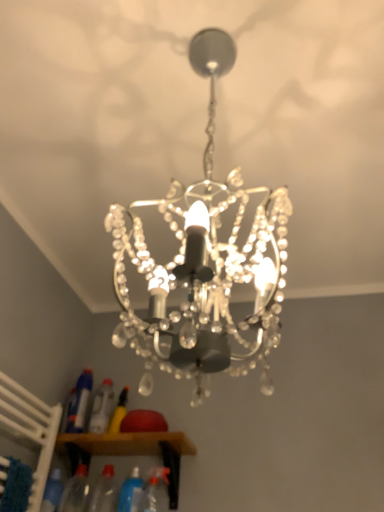
Question: Does clear plastic bottle at lower left, which is the 4th bottle from right to left, have a lesser width compared to wooden cabinet at lower center?

Choices:
 (A) yes
 (B) no

Answer: (A)

Question: Is clear plastic bottle at lower left, which is the 3th bottle in left-to-right order, closer to the viewer compared to wooden cabinet at lower center?

Choices:
 (A) yes
 (B) no

Answer: (B)

Question: Can you confirm if clear plastic bottle at lower left, which is the 4th bottle from right to left, is taller than wooden cabinet at lower center?

Choices:
 (A) yes
 (B) no

Answer: (A)

Question: Is clear plastic bottle at lower left, which is the 3th bottle in left-to-right order, positioned with its back to wooden cabinet at lower center?

Choices:
 (A) yes
 (B) no

Answer: (B)

Question: Is clear plastic bottle at lower left, which is the 4th bottle from right to left, located outside wooden cabinet at lower center?

Choices:
 (A) yes
 (B) no

Answer: (A)

Question: From a real-world perspective, is clear plastic bottle at lower left, which is the 3th bottle in left-to-right order, on wooden cabinet at lower center?

Choices:
 (A) no
 (B) yes

Answer: (B)

Question: Considering the relative positions of wooden cabinet at lower center and clear crystal chandelier at center in the image provided, is wooden cabinet at lower center to the left of clear crystal chandelier at center from the viewer's perspective?

Choices:
 (A) yes
 (B) no

Answer: (A)

Question: Considering the relative positions of wooden cabinet at lower center and clear crystal chandelier at center in the image provided, is wooden cabinet at lower center to the right of clear crystal chandelier at center from the viewer's perspective?

Choices:
 (A) yes
 (B) no

Answer: (B)

Question: From the image's perspective, does wooden cabinet at lower center appear lower than clear crystal chandelier at center?

Choices:
 (A) no
 (B) yes

Answer: (B)

Question: Does wooden cabinet at lower center have a greater width compared to clear crystal chandelier at center?

Choices:
 (A) yes
 (B) no

Answer: (B)

Question: Can you confirm if wooden cabinet at lower center is bigger than clear crystal chandelier at center?

Choices:
 (A) no
 (B) yes

Answer: (A)

Question: Is wooden cabinet at lower center completely or partially outside of clear crystal chandelier at center?

Choices:
 (A) no
 (B) yes

Answer: (B)

Question: Considering the relative sizes of transparent plastic bottle at lower center, the 3th bottle positioned from the right, and translucent plastic spray bottle at lower left, positioned as the first bottle in left-to-right order, in the image provided, is transparent plastic bottle at lower center, the 3th bottle positioned from the right, thinner than translucent plastic spray bottle at lower left, positioned as the first bottle in left-to-right order,?

Choices:
 (A) yes
 (B) no

Answer: (B)